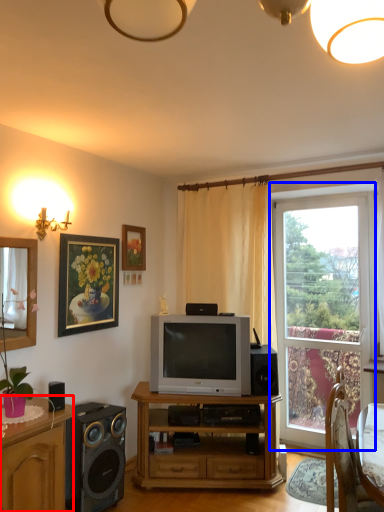
Question: Among these objects, which one is farthest to the camera, cabinetry (highlighted by a red box) or window (highlighted by a blue box)?

Choices:
 (A) cabinetry
 (B) window

Answer: (B)